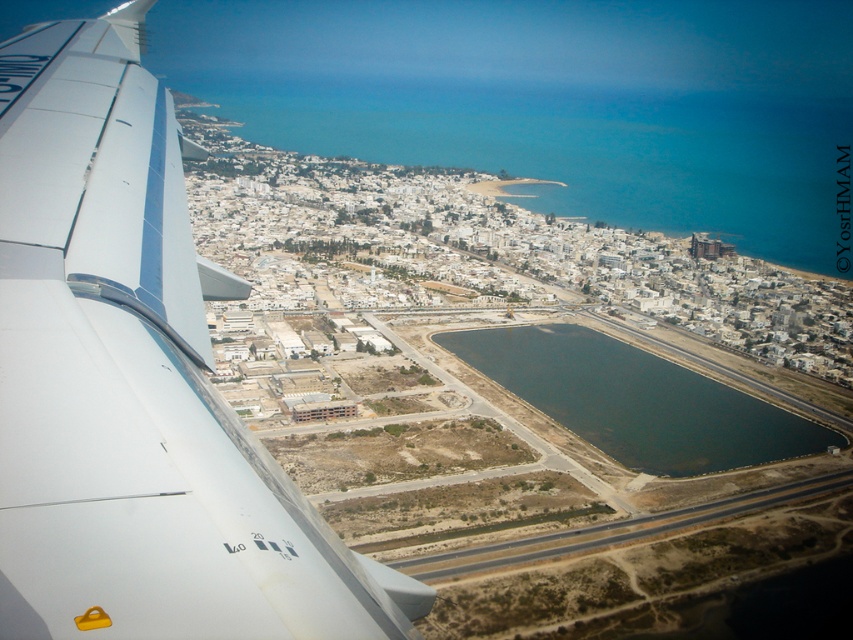
Question: Among these objects, which one is nearest to the camera?

Choices:
 (A) white matte airplane wing at upper left
 (B) dark blue water at center

Answer: (A)

Question: Does white matte airplane wing at upper left lie in front of dark blue water at center?

Choices:
 (A) no
 (B) yes

Answer: (B)

Question: Can you confirm if white matte airplane wing at upper left is bigger than dark blue water at center?

Choices:
 (A) yes
 (B) no

Answer: (A)

Question: Is white matte airplane wing at upper left thinner than dark blue water at center?

Choices:
 (A) no
 (B) yes

Answer: (A)

Question: Which object appears closest to the camera in this image?

Choices:
 (A) white matte airplane wing at upper left
 (B) dark blue water at center

Answer: (A)

Question: Among these objects, which one is farthest from the camera?

Choices:
 (A) white matte airplane wing at upper left
 (B) dark blue water at center

Answer: (B)